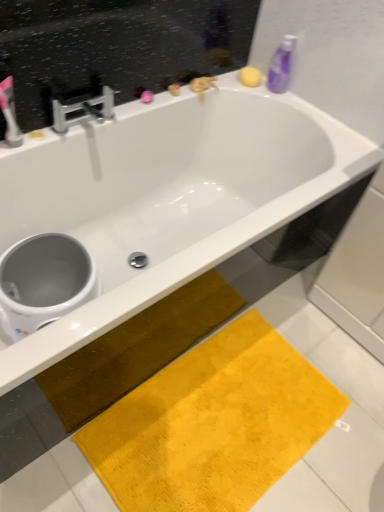
Question: Considering the positions of yellow plush bath mat at lower center and matte white toothbrush at upper left in the image, is yellow plush bath mat at lower center taller or shorter than matte white toothbrush at upper left?

Choices:
 (A) short
 (B) tall

Answer: (A)

Question: From the image's perspective, is yellow plush bath mat at lower center located above or below matte white toothbrush at upper left?

Choices:
 (A) below
 (B) above

Answer: (A)

Question: Estimate the real-world distances between objects in this image. Which object is farther from the white glossy bathtub at upper center?

Choices:
 (A) white glossy toilet bowl at lower left
 (B) purple plastic bottle at upper right
 (C) yellow plush bath mat at lower center
 (D) matte white toothbrush at upper left
 (E) chrome metallic faucet at upper left

Answer: (C)

Question: Which object is the closest to the matte white toothbrush at upper left?

Choices:
 (A) white glossy toilet bowl at lower left
 (B) chrome metallic faucet at upper left
 (C) white glossy bathtub at upper center
 (D) purple plastic bottle at upper right
 (E) yellow plush bath mat at lower center

Answer: (B)